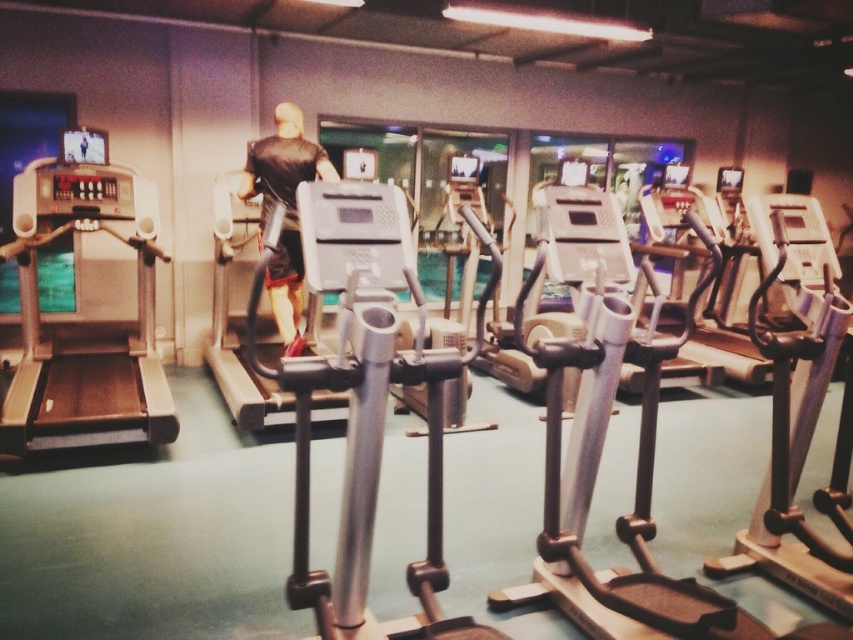
You are a gym member trying to choose between the silver metallic treadmill at left and the matte black treadmill at center for your workout. Considering space constraints, which treadmill would you choose if you want to place it in a narrow hallway? Explain your choice based on their sizes.

The matte black treadmill at center has a smaller width compared to the silver metallic treadmill at left, making it more suitable for placement in a narrow hallway due to its compact size.

In the scene shown: You are standing at the entrance of the gym and see the point marked at coordinates (85, 317). Which object in the gym does this point belong to?

The point at coordinates (85, 317) belongs to the silver metallic treadmill at left.